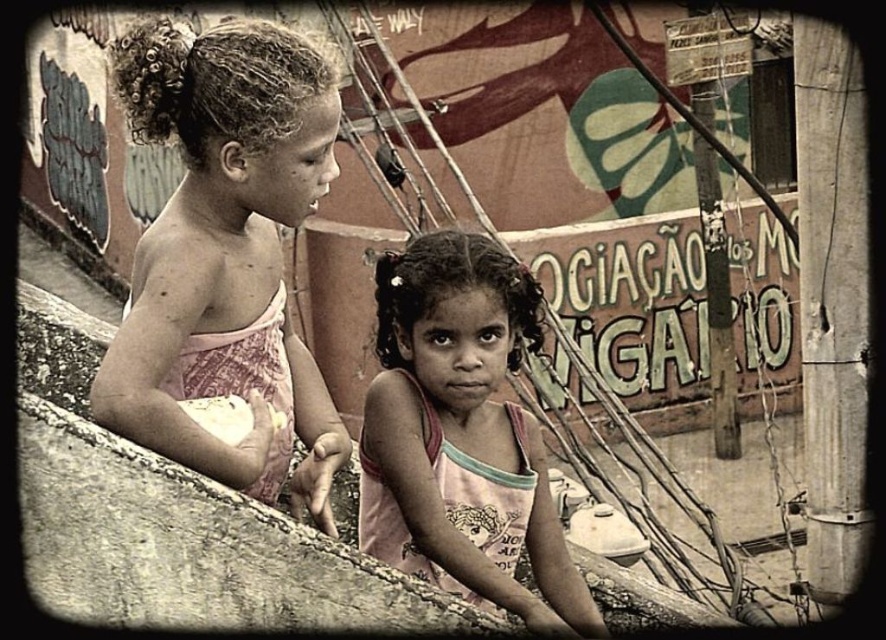
Who is positioned more to the right, pink fabric dress at upper left or pink fabric shirt at center?

From the viewer's perspective, pink fabric shirt at center appears more on the right side.

Is pink fabric dress at upper left wider than pink fabric shirt at center?

Correct, the width of pink fabric dress at upper left exceeds that of pink fabric shirt at center.

At what (x,y) coordinates should I click in order to perform the action: click on pink fabric dress at upper left. Please return your answer as a coordinate pair (x, y). Looking at the image, I should click on (224, 252).

Identify the location of pink fabric dress at upper left. This screenshot has width=886, height=640. (224, 252).